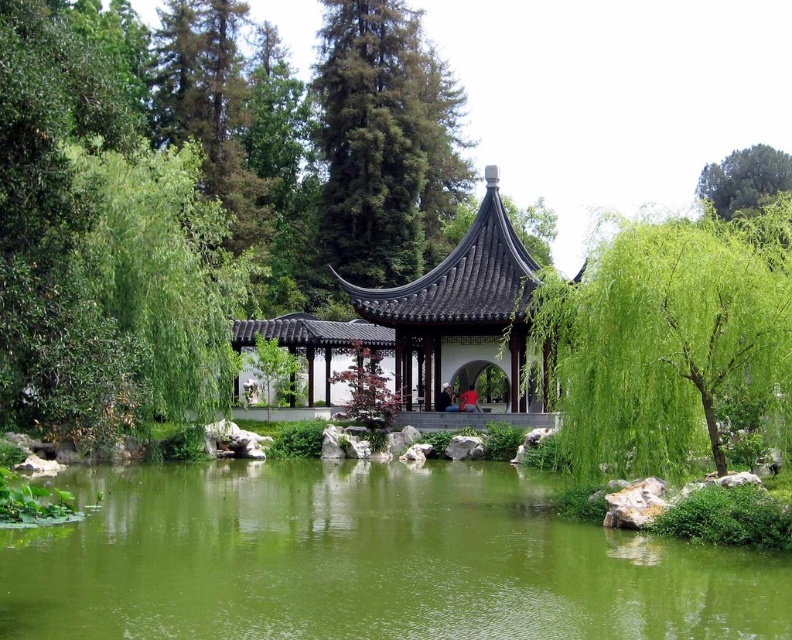
Can you confirm if red fabric person at center is thinner than matte black person at center?

Incorrect, red fabric person at center's width is not less than matte black person at center's.

Is point (473, 410) closer to camera compared to point (440, 388)?

Yes, it is.

Between point (474, 397) and point (452, 406), which one is positioned behind?

The point (474, 397) is more distant.

At what (x,y) coordinates should I click in order to perform the action: click on red fabric person at center. Please return your answer as a coordinate pair (x, y). Looking at the image, I should click on (467, 401).

Does point (623, 337) come closer to viewer compared to point (393, 84)?

Yes, it is in front of point (393, 84).

Is green leafy tree at center thinner than green textured tree at upper center?

Yes.

Where is `green leafy tree at center`? This screenshot has width=792, height=640. green leafy tree at center is located at coordinates (667, 337).

In order to click on green leafy tree at center in this screenshot , I will do `click(667, 337)`.

Can you confirm if black matte gazebo at center is bigger than matte black person at center?

Correct, black matte gazebo at center is larger in size than matte black person at center.

The width and height of the screenshot is (792, 640). Describe the element at coordinates (459, 308) in the screenshot. I see `black matte gazebo at center` at that location.

Locate an element on the screen. black matte gazebo at center is located at coordinates (459, 308).